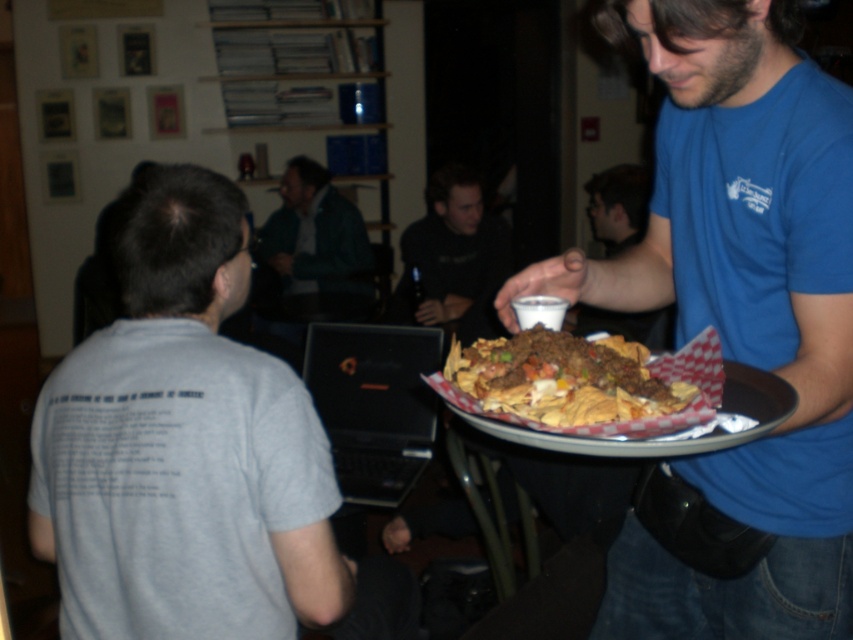
Can you confirm if black matte laptop at center is positioned above dark gray sweater at center?

Incorrect, black matte laptop at center is not positioned above dark gray sweater at center.

The width and height of the screenshot is (853, 640). What do you see at coordinates (374, 404) in the screenshot? I see `black matte laptop at center` at bounding box center [374, 404].

Locate an element on the screen. black matte laptop at center is located at coordinates (374, 404).

Which is behind, point (686, 108) or point (354, 211)?

The point (354, 211) is behind.

Looking at this image, does blue cotton shirt at upper right have a lesser width compared to green fuzzy sweater at upper center?

Indeed, blue cotton shirt at upper right has a lesser width compared to green fuzzy sweater at upper center.

Does point (845, 544) lie in front of point (314, 316)?

Yes, point (845, 544) is in front of point (314, 316).

Locate an element on the screen. This screenshot has width=853, height=640. blue cotton shirt at upper right is located at coordinates (738, 323).

Is point (811, 477) positioned before point (393, 428)?

Yes, it is in front of point (393, 428).

Does blue cotton shirt at upper right appear on the right side of black matte laptop at center?

Indeed, blue cotton shirt at upper right is positioned on the right side of black matte laptop at center.

Locate an element on the screen. The height and width of the screenshot is (640, 853). blue cotton shirt at upper right is located at coordinates [x=738, y=323].

The height and width of the screenshot is (640, 853). Identify the location of blue cotton shirt at upper right. (738, 323).